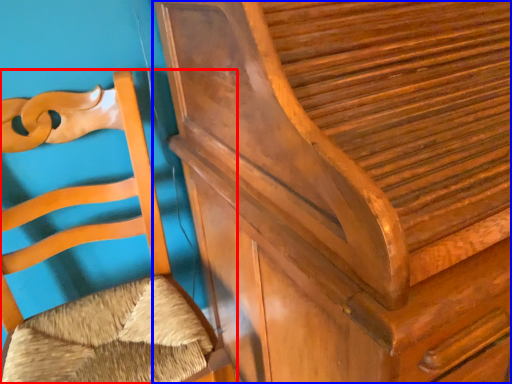
Question: Which point is closer to the camera, furniture (highlighted by a red box) or furniture (highlighted by a blue box)?

Choices:
 (A) furniture
 (B) furniture

Answer: (B)